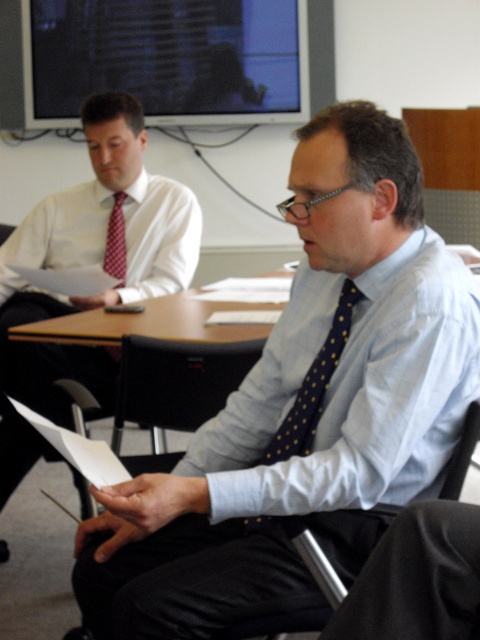
You are sitting at the conference table and want to pass a document to the person wearing the matte white shirt at left. Since you are seated at the black fabric chair at center, which direction should you pass the document?

The matte white shirt at left is to the left of the black fabric chair at center, so you should pass the document to your left.

You are standing at the entrance of the meeting room and see the point marked at coordinates (x=95, y=256). Which object is located at that point?

The point at coordinates (x=95, y=256) marks the matte white shirt at left.